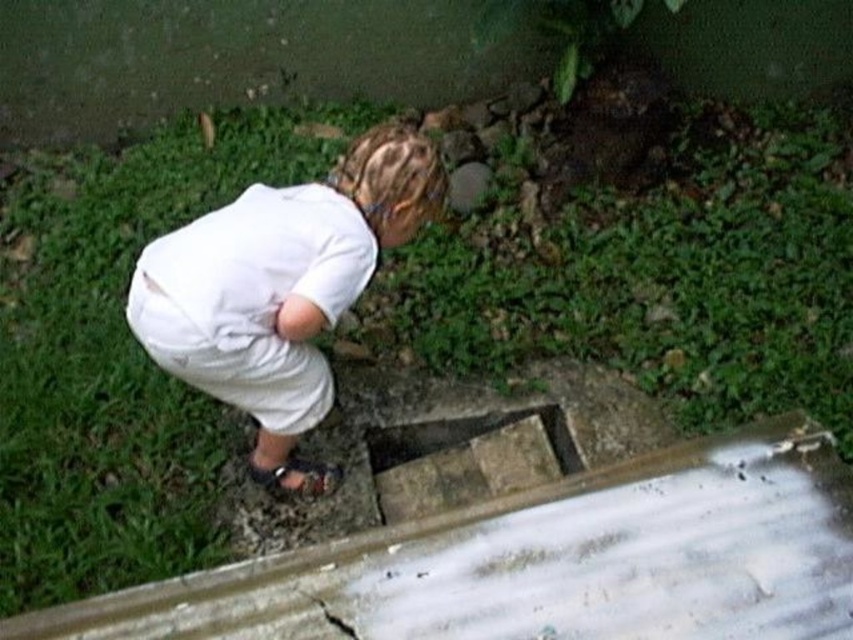
You are a photographer setting up a shoot in the garden. You have a white cotton shirt at center and a black matte crack at lower center in your frame. Which object will appear larger in your photo?

The white cotton shirt at center will appear larger in the photo because it is bigger than the black matte crack at lower center.

You are standing in a garden and see the concrete rectangular hole at center. If you want to avoid stepping into it, which direction should you move relative to the hole?

The concrete rectangular hole at center is located at coordinates (466, 460), so to avoid stepping into it, you should move away from the center point towards the opposite direction of the hole.